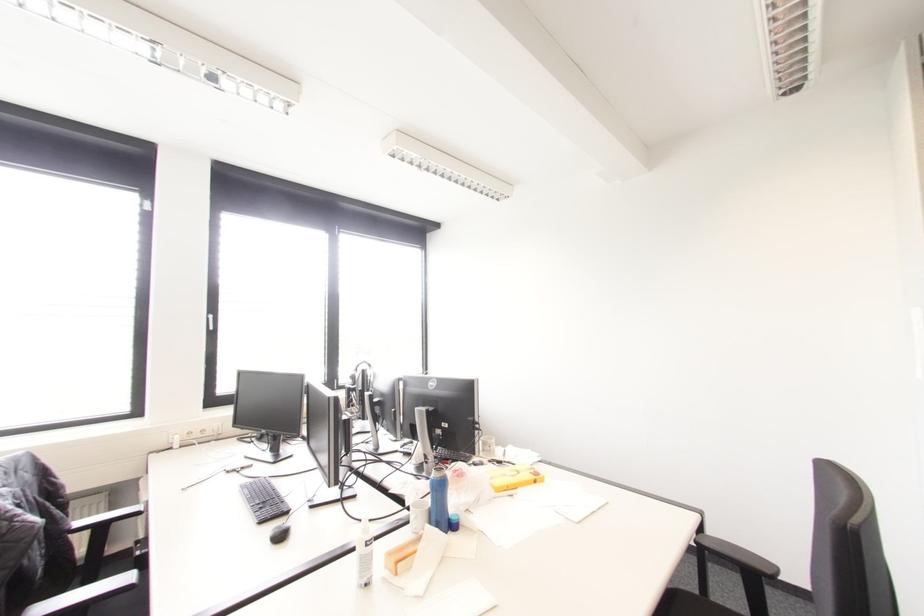
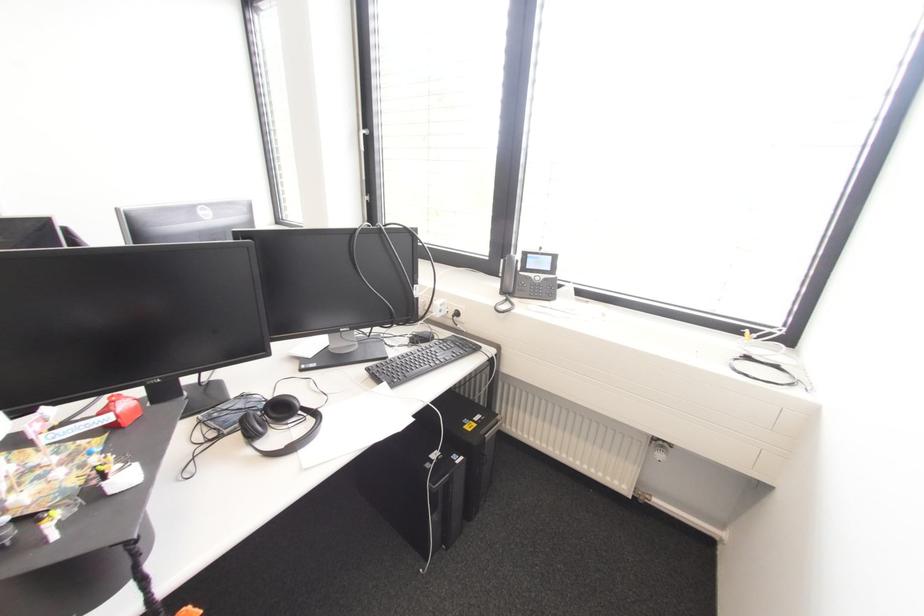
Question: I am providing you with two images of the same scene from different viewpoints. Please identify which objects are invisible in image2.

Choices:
 (A) black headphones
 (B) stack of green paper
 (C) black chair armrest
 (D) phone handset

Answer: (C)